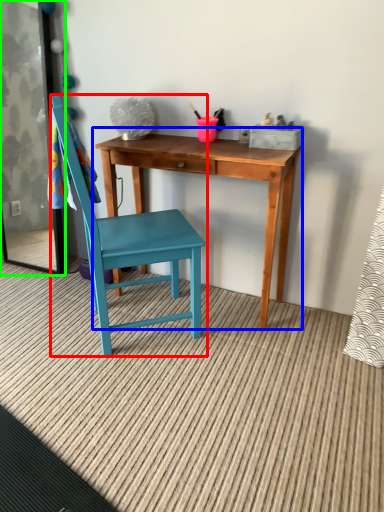
Question: Which is farther away from chair (highlighted by a red box)? table (highlighted by a blue box) or screen door (highlighted by a green box)?

Choices:
 (A) table
 (B) screen door

Answer: (B)